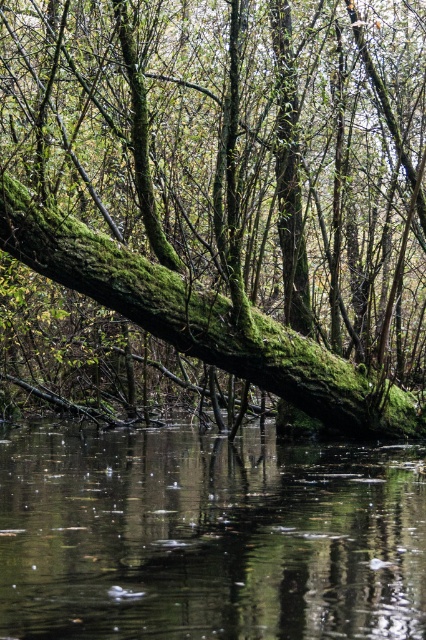
Between green mossy log at center and transparent water at center, which one is positioned lower?

Positioned lower is transparent water at center.

Based on the photo, is green mossy log at center thinner than transparent water at center?

Incorrect, green mossy log at center's width is not less than transparent water at center's.

Between point (0, 198) and point (109, 532), which one is positioned in front?

Point (109, 532) is more forward.

Where is `green mossy log at center`? The image size is (426, 640). green mossy log at center is located at coordinates (230, 186).